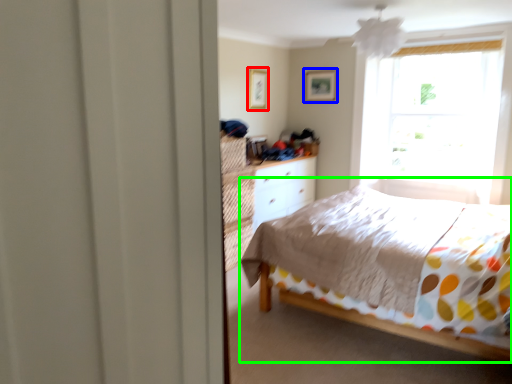
Question: Considering the real-world distances, which object is farthest from picture frame (highlighted by a red box)? picture frame (highlighted by a blue box) or bed (highlighted by a green box)?

Choices:
 (A) picture frame
 (B) bed

Answer: (B)